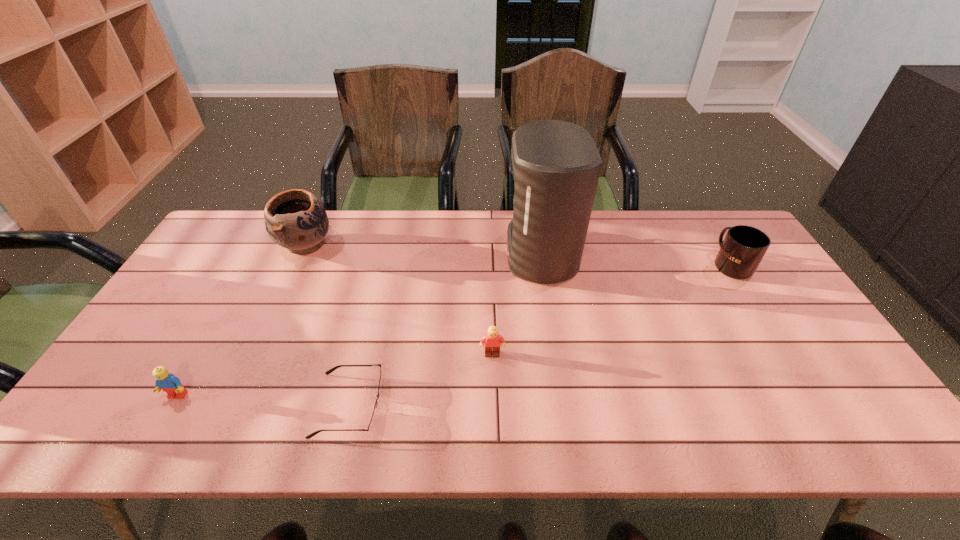
At what (x,y) coordinates should I click in order to perform the action: click on vacant point located between the fourth object from left to right and the fourth object from right to left. Please return your answer as a coordinate pair (x, y). Image resolution: width=960 pixels, height=540 pixels. Looking at the image, I should click on (420, 380).

Where is `free space between the third object from right to left and the nearer Lego`? Image resolution: width=960 pixels, height=540 pixels. free space between the third object from right to left and the nearer Lego is located at coordinates (335, 375).

Find the location of a particular element. This screenshot has width=960, height=540. free spot between the third object from left to right and the tallest object is located at coordinates (444, 329).

Locate an element on the screen. The height and width of the screenshot is (540, 960). the second closest object relative to the second object from right to left is located at coordinates coord(743,248).

Locate which object ranks fourth in proximity to the fourth object from right to left. Please provide its 2D coordinates. Your answer should be formatted as a tuple, i.e. [(x, y)], where the tuple contains the x and y coordinates of a point satisfying the conditions above.

[(556, 165)]

Where is `free location that satisfies the following two spatial constraints: 1. on the face of the right Lego; 2. on the front-facing side of the third object from left to right`? The image size is (960, 540). free location that satisfies the following two spatial constraints: 1. on the face of the right Lego; 2. on the front-facing side of the third object from left to right is located at coordinates (493, 405).

Where is `vacant space that satisfies the following two spatial constraints: 1. on the button side of the coffee maker; 2. on the face of the leftmost object`? The image size is (960, 540). vacant space that satisfies the following two spatial constraints: 1. on the button side of the coffee maker; 2. on the face of the leftmost object is located at coordinates (563, 396).

The width and height of the screenshot is (960, 540). What are the coordinates of `vacant region that satisfies the following two spatial constraints: 1. with the handle on the side of the mug; 2. on the button side of the coffee maker` in the screenshot? It's located at (724, 254).